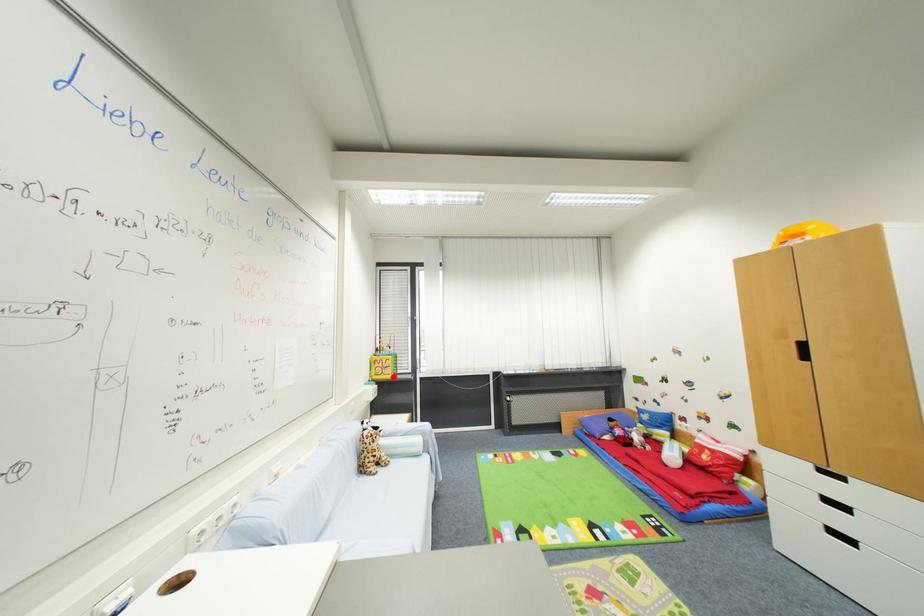
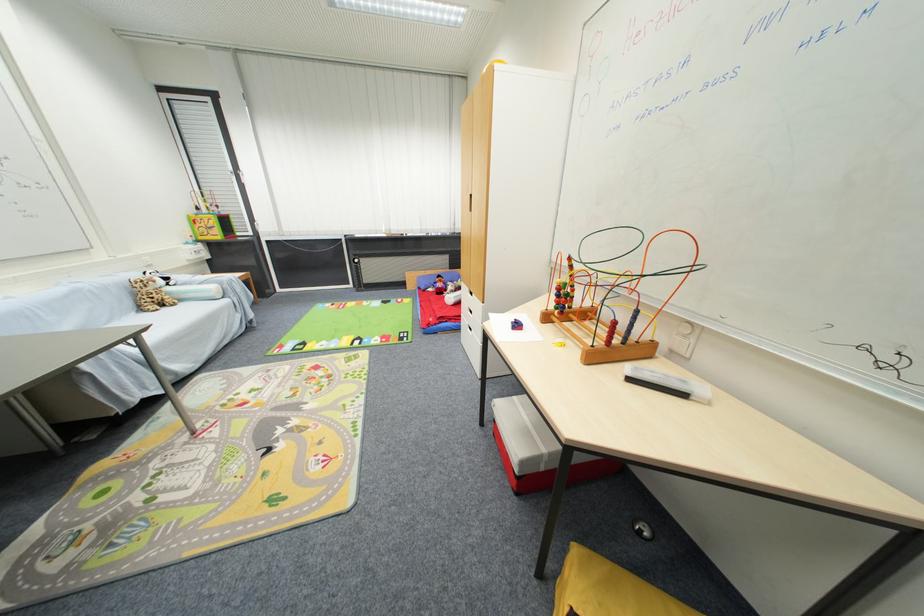
Locate, in the second image, the point that corresponds to the highlighted location in the first image.

(223, 238)